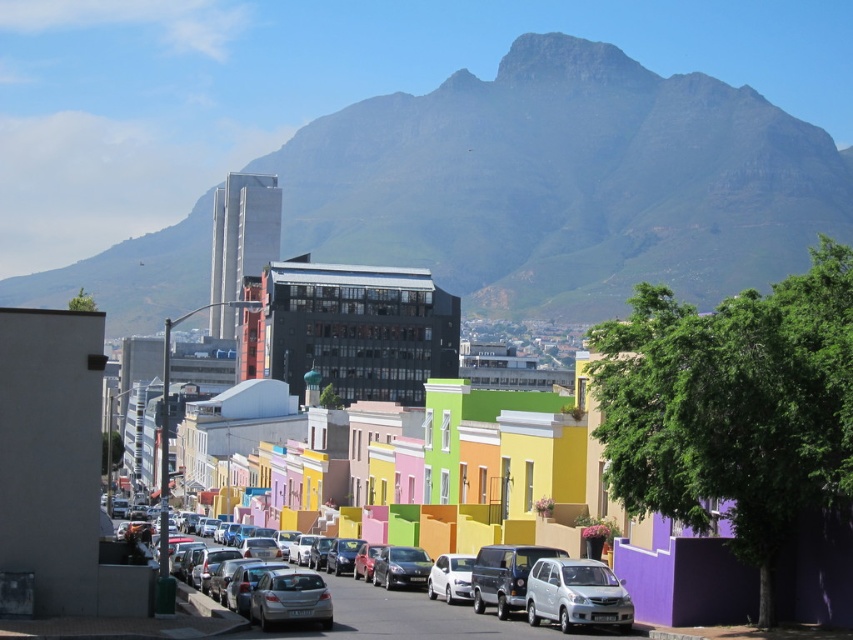
Is shiny silver sedan at center shorter than white matte van at center?

No, shiny silver sedan at center is not shorter than white matte van at center.

Is shiny silver sedan at center above white matte van at center?

No, shiny silver sedan at center is not above white matte van at center.

Does point (415, 593) lie in front of point (541, 608)?

That is False.

I want to click on shiny silver sedan at center, so click(410, 616).

Which of these two, rugged granite mountain at upper center or white matte van at center, stands shorter?

white matte van at center is shorter.

Does rugged granite mountain at upper center appear under white matte van at center?

Incorrect, rugged granite mountain at upper center is not positioned below white matte van at center.

Does point (672, 268) come in front of point (581, 561)?

No, it is behind (581, 561).

You are a GUI agent. You are given a task and a screenshot of the screen. Output one action in this format:
    pyautogui.click(x=<x>, y=<y>)
    Task: Click on the rugged granite mountain at upper center
    
    Given the screenshot: What is the action you would take?
    pyautogui.click(x=566, y=182)

Identify the location of rugged granite mountain at upper center. tap(566, 182).

Who is more forward, (x=804, y=180) or (x=444, y=580)?

Positioned in front is point (x=444, y=580).

The width and height of the screenshot is (853, 640). Identify the location of rugged granite mountain at upper center. (566, 182).